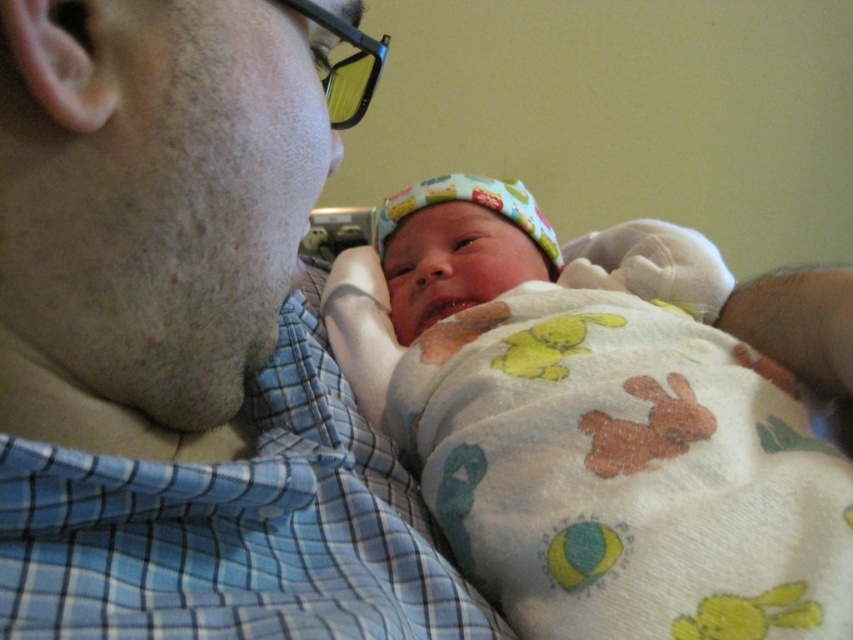
You are a photographer setting up for a portrait session. You need to ensure that the blue plaid shirt at upper left and the soft cotton blanket at center are both visible in the frame. Based on their positions, which object should you adjust first to keep both in view if the camera angle shifts slightly downward?

The blue plaid shirt at upper left is located below the soft cotton blanket at center. If the camera angle shifts downward, the blue plaid shirt at upper left might exit the frame first since it is already positioned lower. Adjust the blue plaid shirt at upper left first to maintain visibility.

You are a photographer trying to capture the baby in the soft cotton blanket at center without the blue plaid shirt at upper left blocking the view. Can you move to the right side of the shirt to get a clear shot of the blanket?

The blue plaid shirt at upper left is positioned on the left side of the soft cotton blanket at center, so moving to the right side of the shirt would allow you to see the blanket without obstruction.

You are a photographer setting up a shoot for a clothing catalog. You need to ensure that the blue plaid shirt at upper left and the soft cotton blanket at center are both visible in the frame. Given their sizes, which object should you adjust the camera angle to focus on first to ensure it doesn

The blue plaid shirt at upper left is much taller than the soft cotton blanket at center, so you should adjust the camera angle to focus on the blue plaid shirt at upper left first to ensure it is fully visible in the frame.